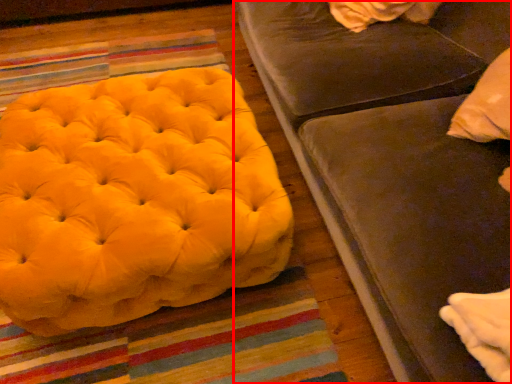
Question: Considering the relative positions of studio couch (annotated by the red box) and furniture in the image provided, where is studio couch (annotated by the red box) located with respect to the staircase?

Choices:
 (A) right
 (B) left

Answer: (A)